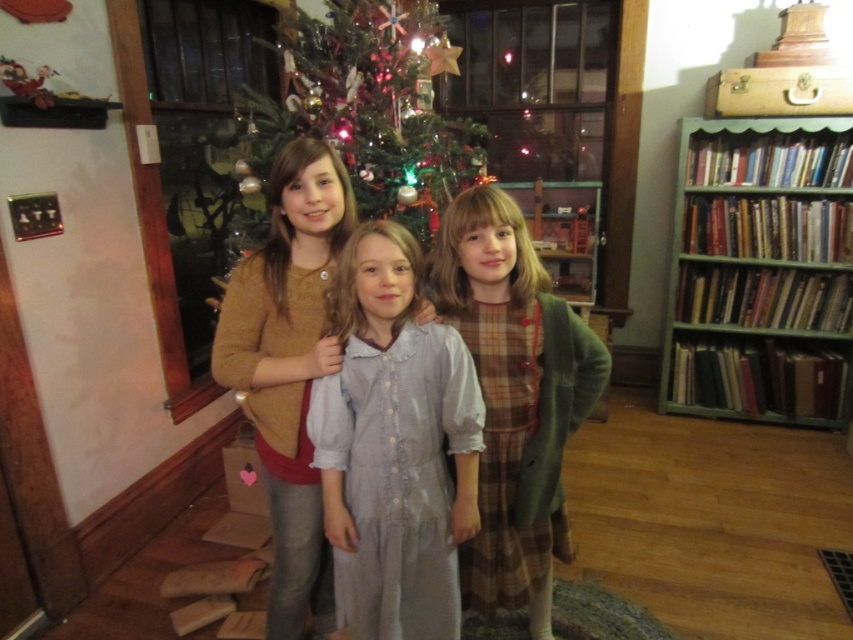
You are planning to place a new bookshelf in the living room. The current green painted wood bookshelf at right is narrower than the green textured christmas tree at center. If you want to place a bookshelf wider than the existing one but not wider than the tree, what is the maximum width you can choose?

The maximum width you can choose for the new bookshelf is just under the width of the green textured christmas tree at center, as the existing green painted wood bookshelf at right is narrower than the tree, so the new bookshelf must be wider than the current one but not exceed the tree width.

You are a photographer setting up a tripod to capture the girls and the Christmas tree. The tripod can only accommodate objects up to 1.5 meters in height. Given that the light blue cotton dress at center and the green textured christmas tree at center are both in the center, which object should you focus on to ensure it fits within the tripod height limit?

The light blue cotton dress at center is shorter than the green textured christmas tree at center, so focusing on the light blue cotton dress at center ensures it fits within the tripod height limit of 1.5 meters.